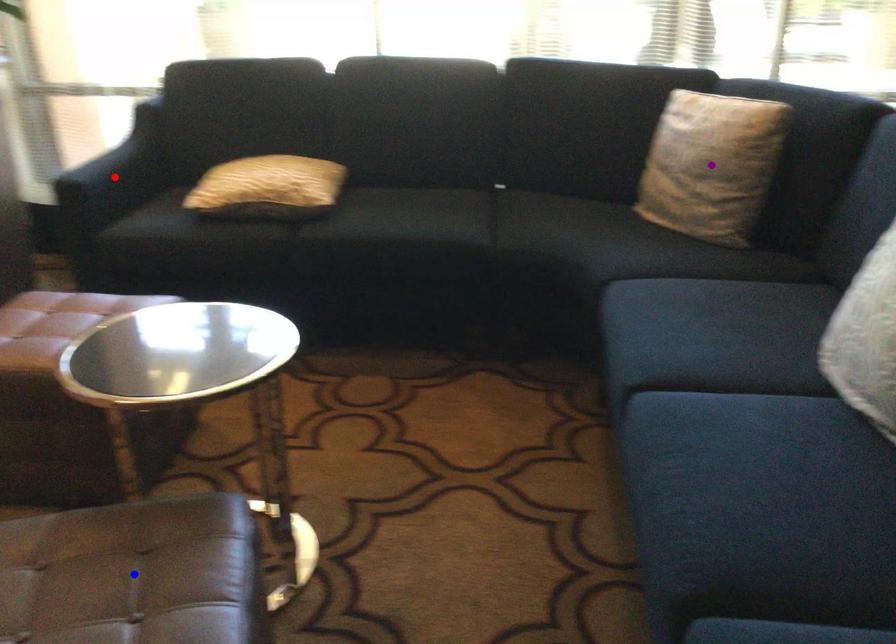
Order these from nearest to farthest:
purple point
blue point
red point

blue point
red point
purple point